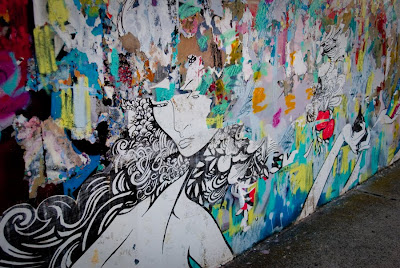
Locate an element on the screen. concrete floor is located at coordinates (348, 240).